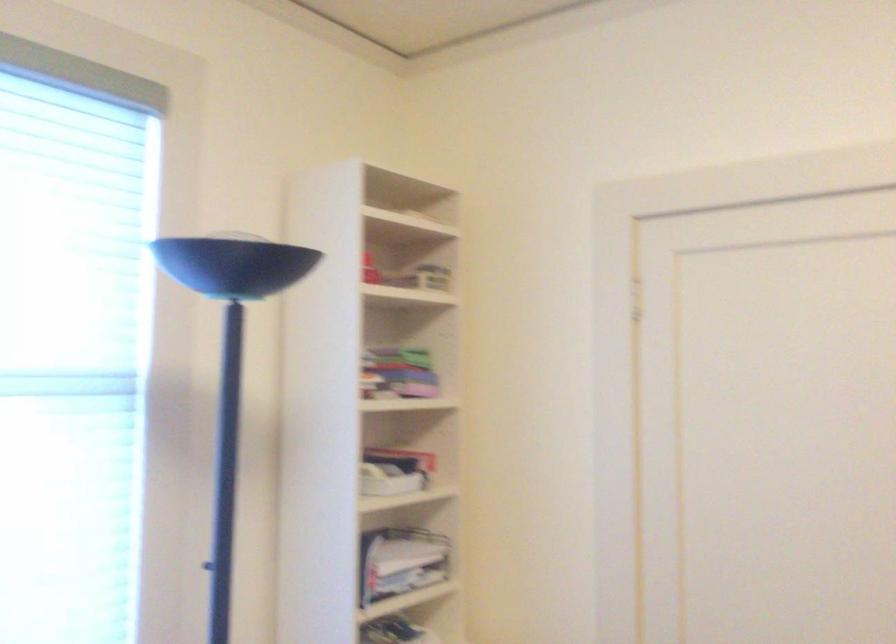
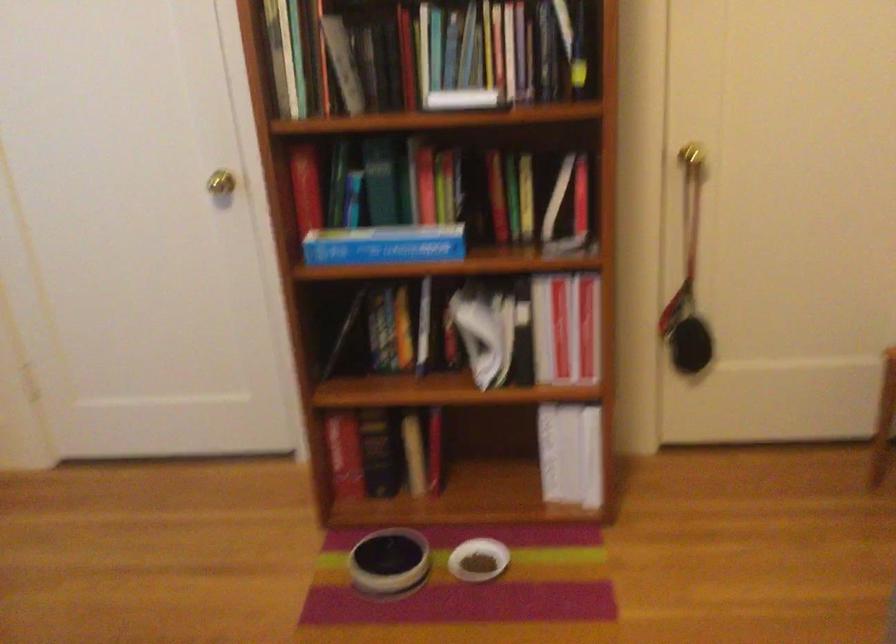
How did the camera likely rotate?

The rotation direction of the camera is right-down.